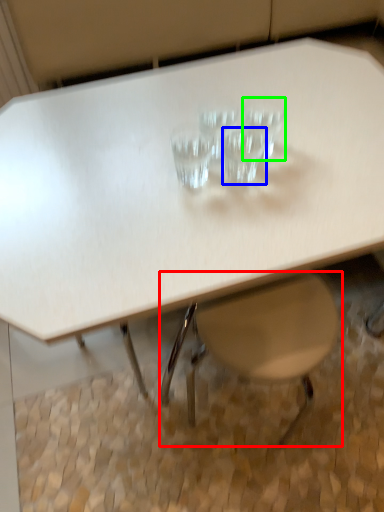
Question: Which is nearer to the swivel chair (highlighted by a red box)? martini glass (highlighted by a blue box) or martini glass (highlighted by a green box).

Choices:
 (A) martini glass
 (B) martini glass

Answer: (A)